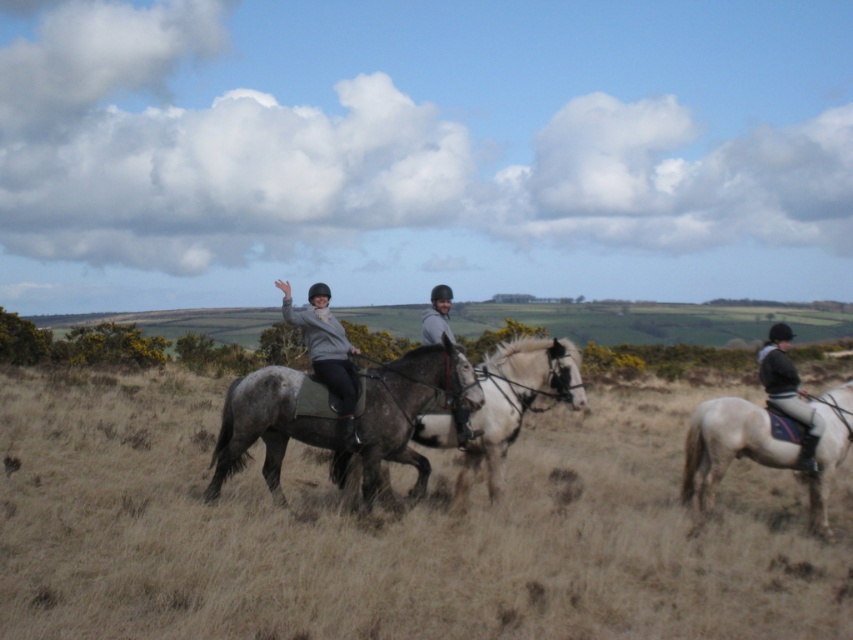
Between gray matte horse at center and dark gray leather jacket at right, which one appears on the left side from the viewer's perspective?

gray matte horse at center

Is gray matte horse at center below dark gray leather jacket at right?

Indeed, gray matte horse at center is positioned under dark gray leather jacket at right.

Identify the location of gray matte horse at center. Image resolution: width=853 pixels, height=640 pixels. (340, 420).

Is dry grass at center shorter than gray matte horse at center?

Correct, dry grass at center is not as tall as gray matte horse at center.

This screenshot has height=640, width=853. Find the location of `dry grass at center`. dry grass at center is located at coordinates (393, 529).

How much distance is there between gray matte horse at center and white glossy horse at right?

A distance of 11.16 feet exists between gray matte horse at center and white glossy horse at right.

Does point (247, 438) come in front of point (825, 516)?

Yes, it is in front of point (825, 516).

Between point (383, 436) and point (704, 502), which one is positioned in front?

Positioned in front is point (383, 436).

Identify the location of gray matte horse at center. The height and width of the screenshot is (640, 853). point(340,420).